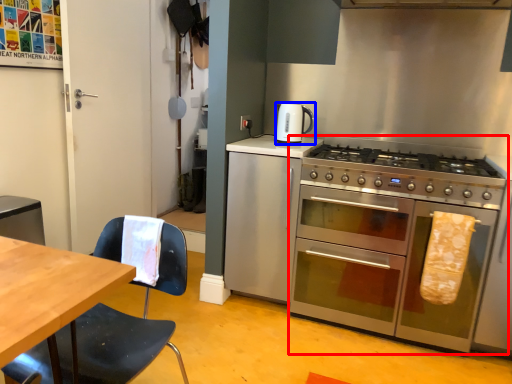
Question: Which object appears closest to the camera in this image, oven (highlighted by a red box) or kitchen appliance (highlighted by a blue box)?

Choices:
 (A) oven
 (B) kitchen appliance

Answer: (A)